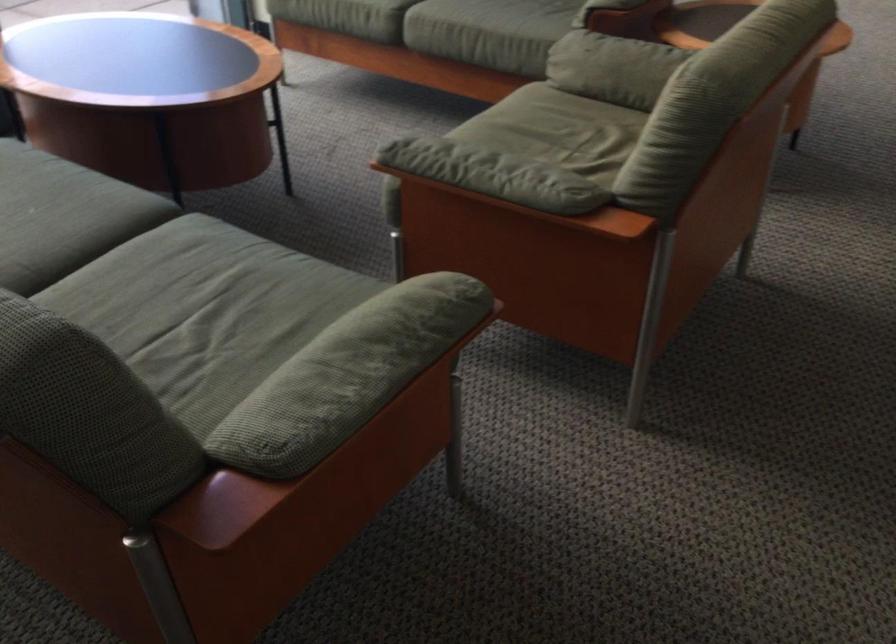
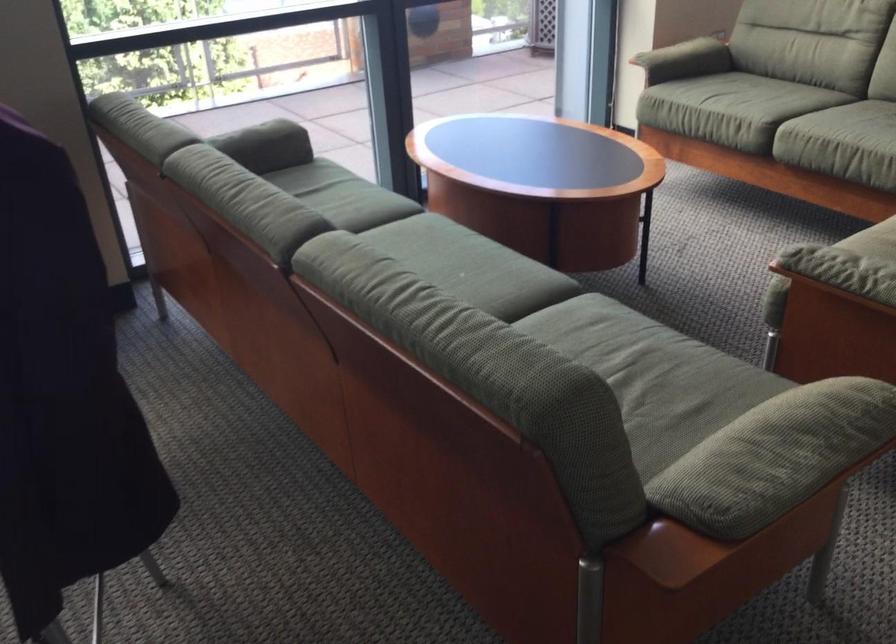
Locate, in the second image, the point that corresponds to point (435, 158) in the first image.

(834, 263)